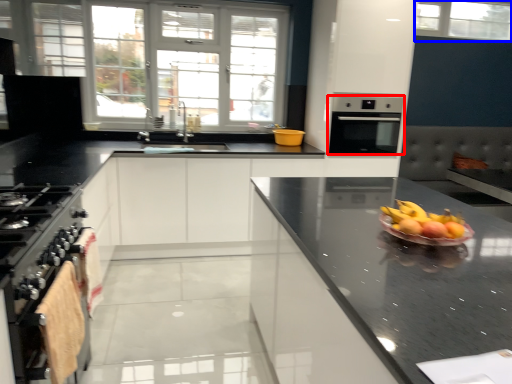
Question: Among these objects, which one is farthest to the camera, oven (highlighted by a red box) or window (highlighted by a blue box)?

Choices:
 (A) oven
 (B) window

Answer: (B)